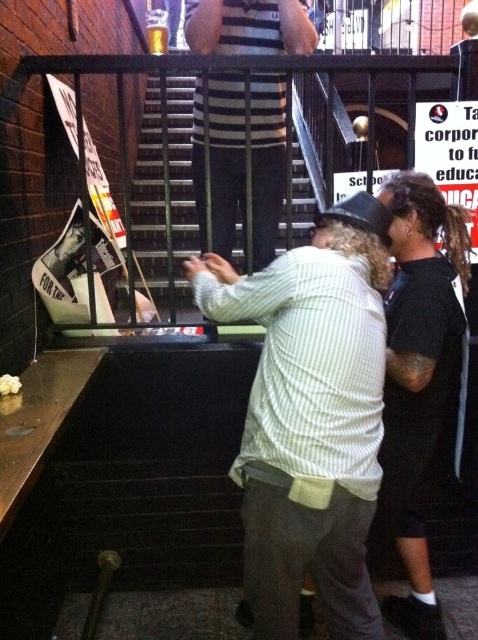
You are standing at the entrance of the bar and see the white striped shirt at center. If you want to approach the person wearing it, in which direction should you move relative to your current position?

The white striped shirt at center is located at point (x=311, y=416), so you should move towards the center of the scene to reach the person wearing it.